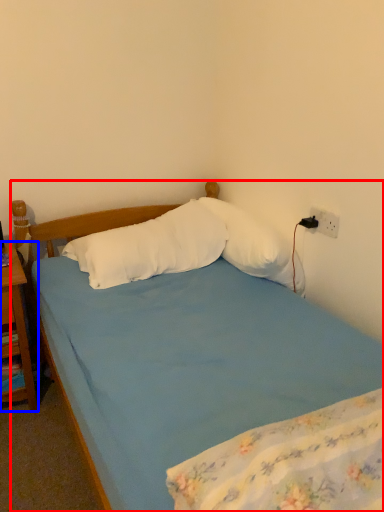
Question: Which of the following is the closest to the observer, bed (highlighted by a red box) or nightstand (highlighted by a blue box)?

Choices:
 (A) bed
 (B) nightstand

Answer: (A)